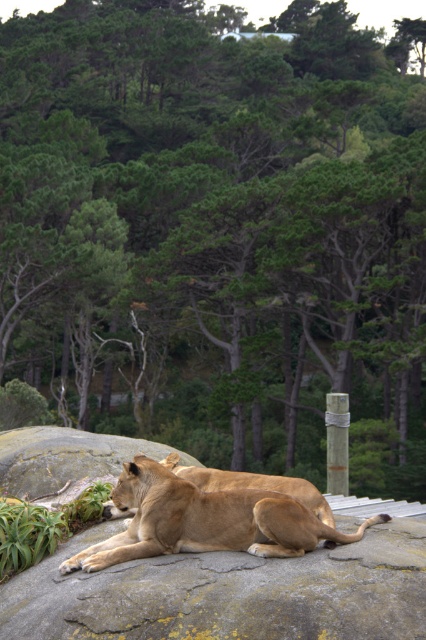
Image resolution: width=426 pixels, height=640 pixels. What do you see at coordinates (204, 520) in the screenshot?
I see `golden fur lion at center` at bounding box center [204, 520].

Locate an element on the screen. golden fur lion at center is located at coordinates (204, 520).